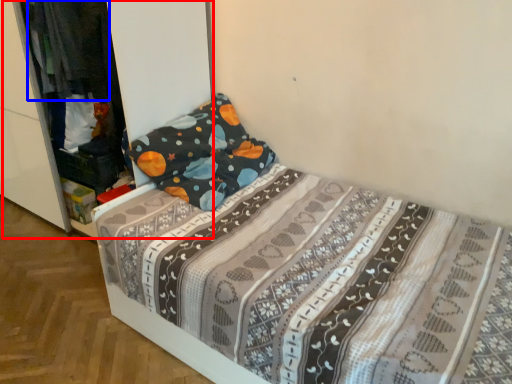
Question: Which object is closer to the camera taking this photo, dresser (highlighted by a red box) or clothing (highlighted by a blue box)?

Choices:
 (A) dresser
 (B) clothing

Answer: (A)